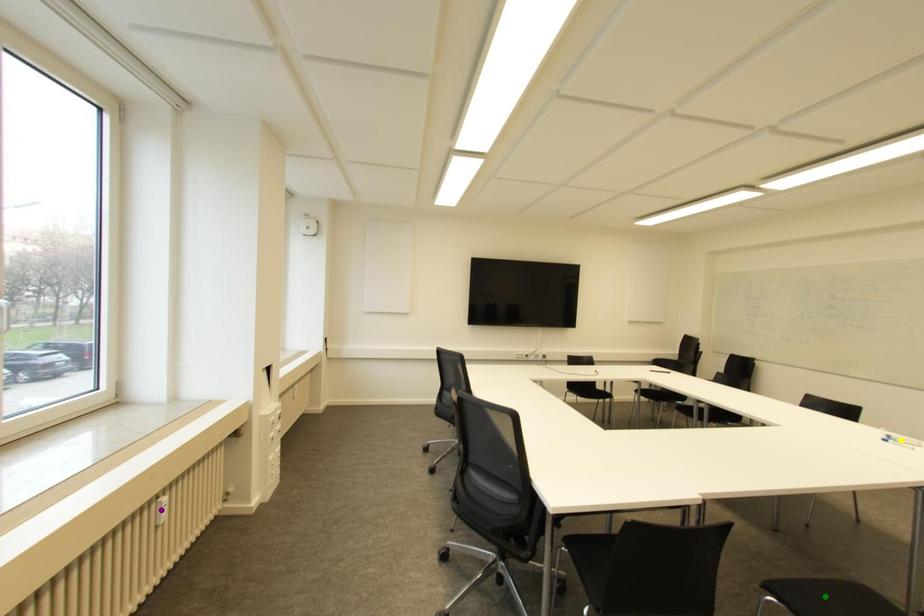
Order these from nearest to farthest:
1. yellow point
2. purple point
3. green point

yellow point → purple point → green point